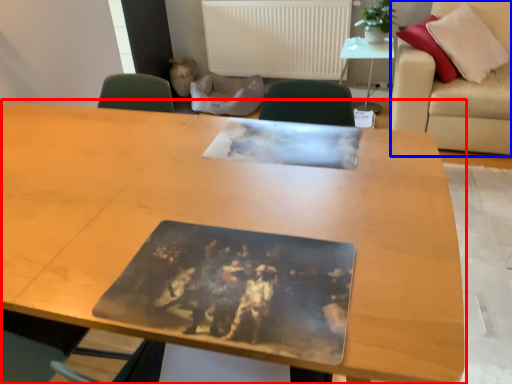
Question: Which object is closer to the camera taking this photo, table (highlighted by a red box) or couch (highlighted by a blue box)?

Choices:
 (A) table
 (B) couch

Answer: (A)